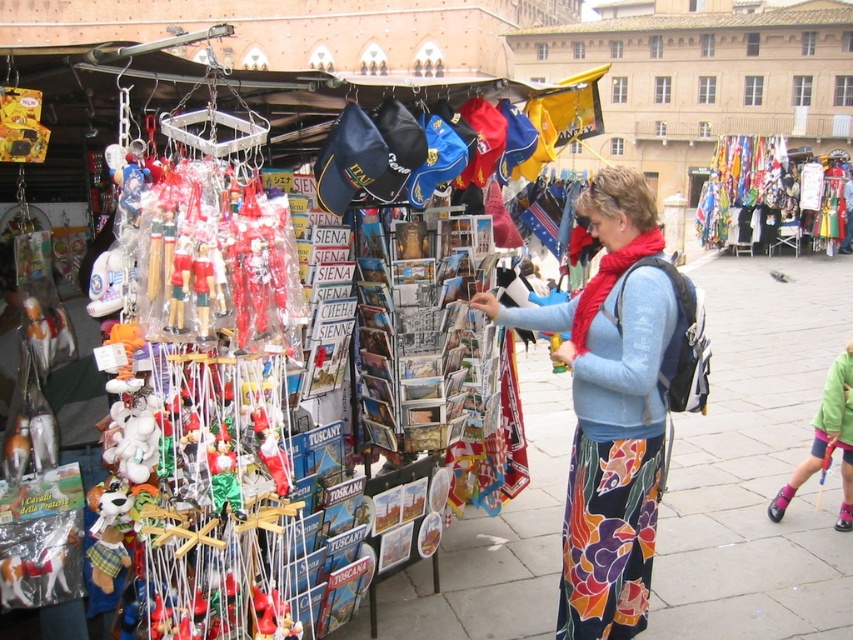
You are a customer at the market stall and want to pick up the plastic pink toy at lower right. Is the floral cotton skirt at center blocking your access to it?

The floral cotton skirt at center is located above the plastic pink toy at lower right, so it is not blocking access to the toy.

You are a photographer standing at the center of the market. You want to take a picture of the floral cotton skirt at center. Where should you aim your camera to capture it?

The floral cotton skirt at center is located at point 0.641 on the x axis and 0.717 on the y axis, so you should aim your camera at those coordinates to capture it.

You are a delivery robot with a 10 feet long package. You need to place the package between the floral cotton skirt at center and the plastic pink toy at lower right. Is there enough space?

The floral cotton skirt at center and plastic pink toy at lower right are 12.51 feet apart, so yes, the delivery robot can place the 10 feet long package between them since the distance between the two objects is sufficient.